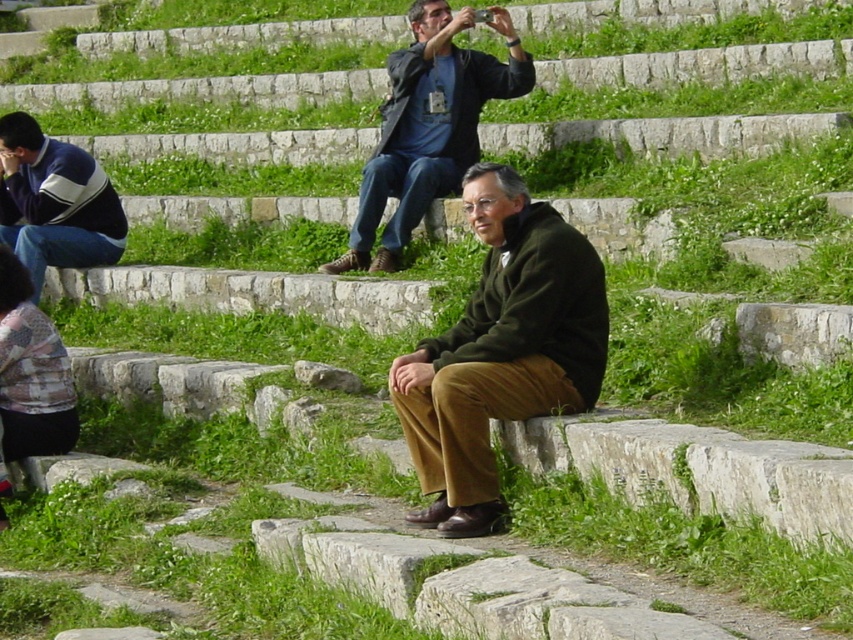
How far apart are dark green sweater at center and dark blue jacket at upper center?

The distance of dark green sweater at center from dark blue jacket at upper center is 4.05 meters.

Is dark green sweater at center bigger than dark blue jacket at upper center?

No.

Identify the location of dark green sweater at center. The image size is (853, 640). (502, 349).

Which is behind, point (454, 483) or point (33, 125)?

The point (33, 125) is behind.

Is dark green sweater at center shorter than blue and white sweater at left?

No, dark green sweater at center is not shorter than blue and white sweater at left.

Where is `dark green sweater at center`? This screenshot has height=640, width=853. dark green sweater at center is located at coordinates (502, 349).

This screenshot has height=640, width=853. In order to click on dark green sweater at center in this screenshot , I will do `click(502, 349)`.

Between dark blue jacket at upper center and blue and white sweater at left, which one has less height?

blue and white sweater at left

Does point (410, 214) come closer to viewer compared to point (51, 180)?

Yes, point (410, 214) is closer to viewer.

Describe the element at coordinates (428, 125) in the screenshot. I see `dark blue jacket at upper center` at that location.

You are a GUI agent. You are given a task and a screenshot of the screen. Output one action in this format:
    pyautogui.click(x=<x>, y=<y>)
    Task: Click on the dark blue jacket at upper center
    The image size is (853, 640).
    Given the screenshot: What is the action you would take?
    pyautogui.click(x=428, y=125)